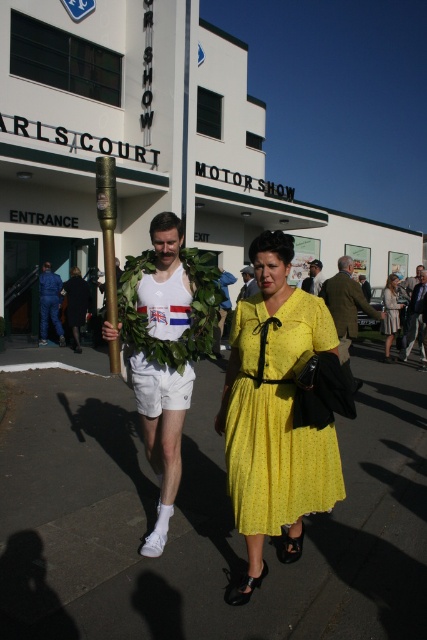
Which of these two, dark gray asphalt at center or matte gold torch at center, stands taller?

Standing taller between the two is matte gold torch at center.

Does point (160, 592) come farther from viewer compared to point (310, 285)?

No, it is in front of (310, 285).

Locate an element on the screen. dark gray asphalt at center is located at coordinates (202, 522).

Can you confirm if gold metallic pole at center is positioned below blue denim jumpsuit at center?

Incorrect, gold metallic pole at center is not positioned below blue denim jumpsuit at center.

Who is more distant from viewer, (105, 282) or (49, 307)?

Point (49, 307)

This screenshot has width=427, height=640. Find the location of `gold metallic pole at center`. gold metallic pole at center is located at coordinates (108, 246).

Does blue denim jumpsuit at center have a smaller size compared to matte gold torch at center?

Indeed, blue denim jumpsuit at center has a smaller size compared to matte gold torch at center.

Which is in front, point (43, 289) or point (315, 276)?

Point (315, 276)

Is point (40, 305) positioned behind point (312, 276)?

Yes, it is.

Where is `blue denim jumpsuit at center`? This screenshot has height=640, width=427. blue denim jumpsuit at center is located at coordinates (49, 304).